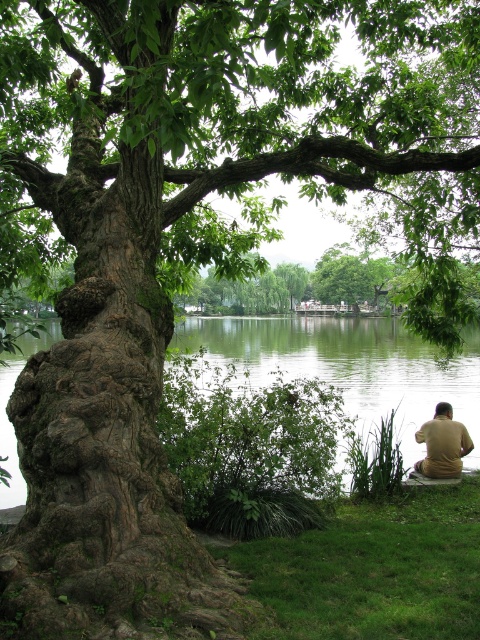
You are standing in the serene outdoor scene and want to walk from the green liquid water at center to the green grass at lower right. Which direction should you head?

You should head to the right since the green grass at lower right is located to the right of the green liquid water at center.

You are planning to host a picnic and need to choose between the green liquid water at center or the brown wooden bench at lower right for setting up. Based on their sizes, which area would be more suitable for placing a picnic basket?

The brown wooden bench at lower right occupies more space than the green liquid water at center, so it would be more suitable for placing a picnic basket.